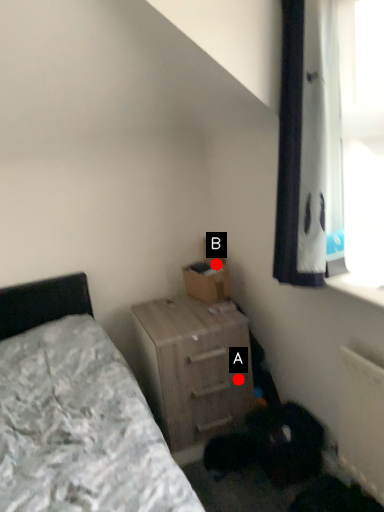
Question: Two points are circled on the image, labeled by A and B beside each circle. Which point appears closest to the camera in this image?

Choices:
 (A) A is closer
 (B) B is closer

Answer: (A)